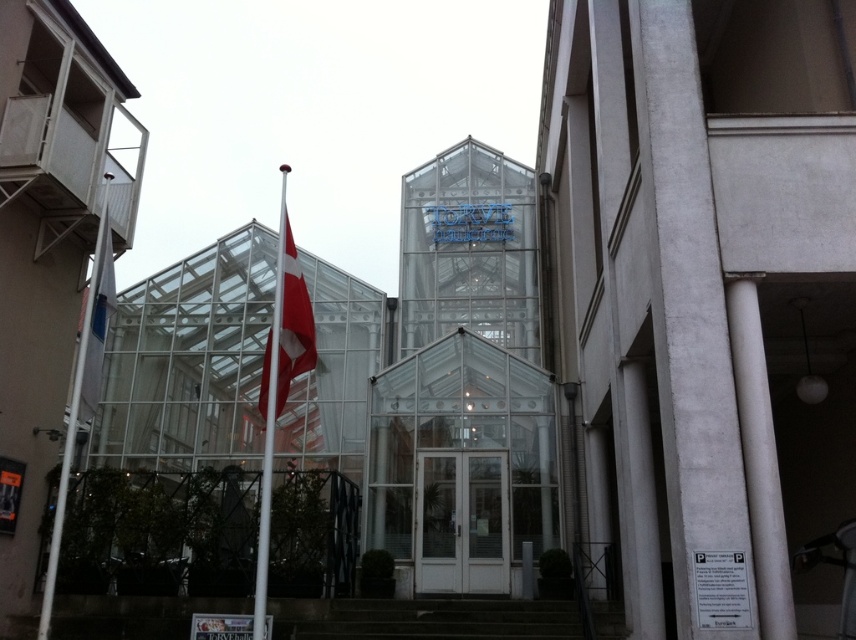
Question: Can you confirm if concrete stairs at center is positioned to the left of white fabric flag at left?

Choices:
 (A) no
 (B) yes

Answer: (A)

Question: Is red fabric flag at center behind white metallic flag pole at center?

Choices:
 (A) yes
 (B) no

Answer: (A)

Question: Observing the image, what is the correct spatial positioning of white metallic flag pole at left in reference to red fabric flag at center?

Choices:
 (A) above
 (B) below

Answer: (B)

Question: Which object is farther from the camera taking this photo?

Choices:
 (A) white smooth pillar at right
 (B) red fabric flag at center
 (C) white metallic flag pole at left

Answer: (C)

Question: Which of these objects is positioned farthest from the white metallic flag pole at left?

Choices:
 (A) white glass doors at center
 (B) white fabric flag at left
 (C) white concrete pillar at right
 (D) white smooth column at right

Answer: (D)

Question: Considering the real-world distances, which object is farthest from the white metallic flag pole at left?

Choices:
 (A) white metallic flag pole at center
 (B) white fabric flag at left

Answer: (A)